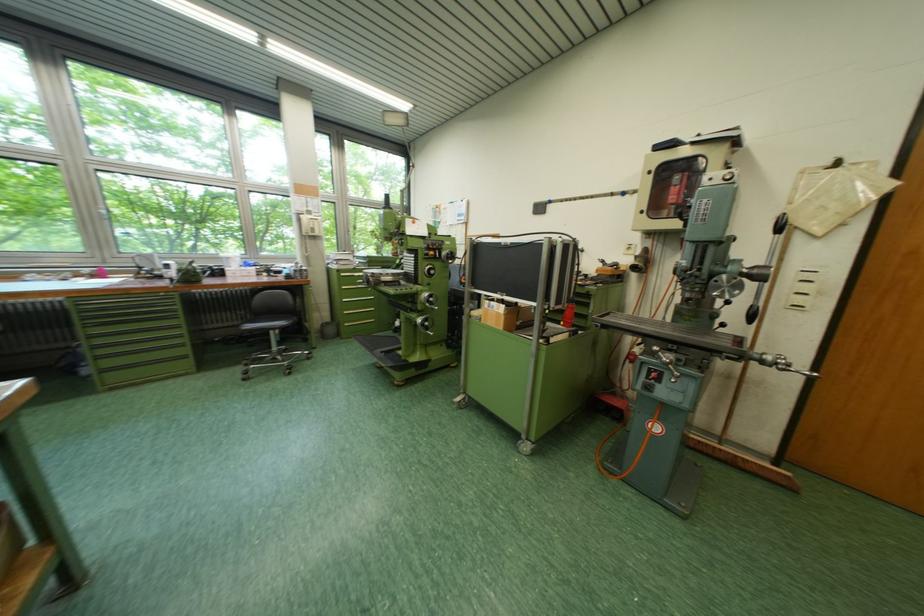
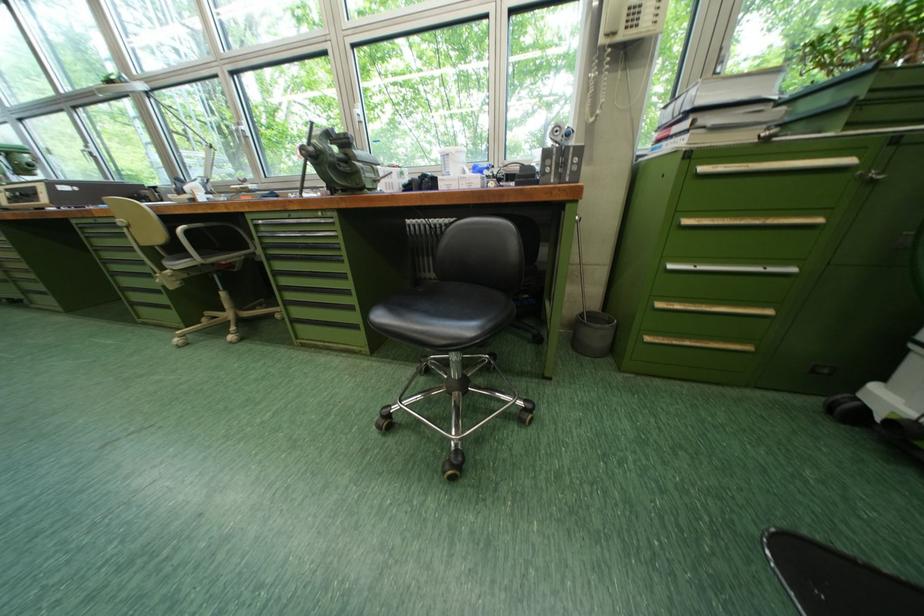
Where in the second image is the point corresponding to the point at 357,326 from the first image?

(659, 341)